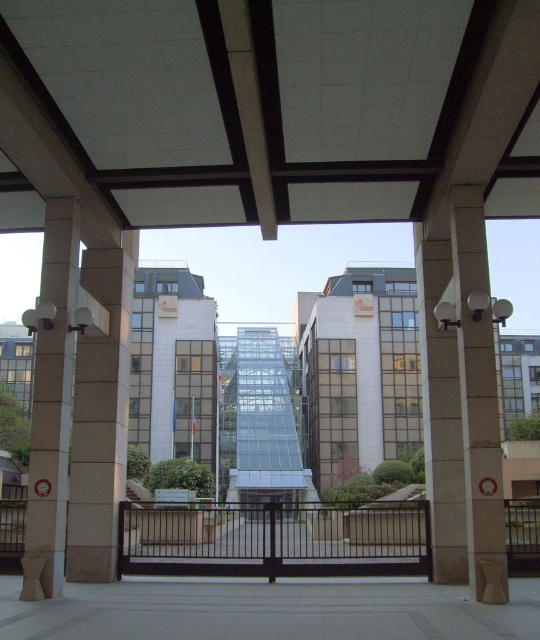
Is sanded concrete pillar at right thinner than brown stone column at left?

Indeed, sanded concrete pillar at right has a lesser width compared to brown stone column at left.

Is sanded concrete pillar at right positioned at the back of brown stone column at left?

Yes, sanded concrete pillar at right is behind brown stone column at left.

Where is `sanded concrete pillar at right`? sanded concrete pillar at right is located at coordinates (478, 400).

Who is shorter, white tile ceiling at center or slate gray concrete pillar at right?

Standing shorter between the two is white tile ceiling at center.

Between point (202, 225) and point (435, 212), which one is positioned behind?

Point (202, 225)

This screenshot has width=540, height=640. Find the location of `white tile ceiling at center`. white tile ceiling at center is located at coordinates (258, 100).

Can you confirm if brown stone column at left is wider than slate gray concrete pillar at right?

No.

Which is in front, point (64, 358) or point (420, 346)?

Point (64, 358) is in front.

Locate an element on the screen. This screenshot has height=640, width=540. brown stone column at left is located at coordinates (51, 404).